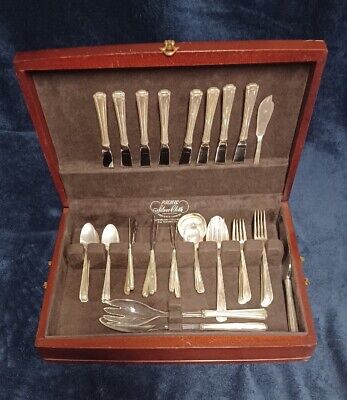
The height and width of the screenshot is (400, 347). Find the location of `forks`. forks is located at coordinates (238, 298), (243, 294), (264, 302), (266, 289).